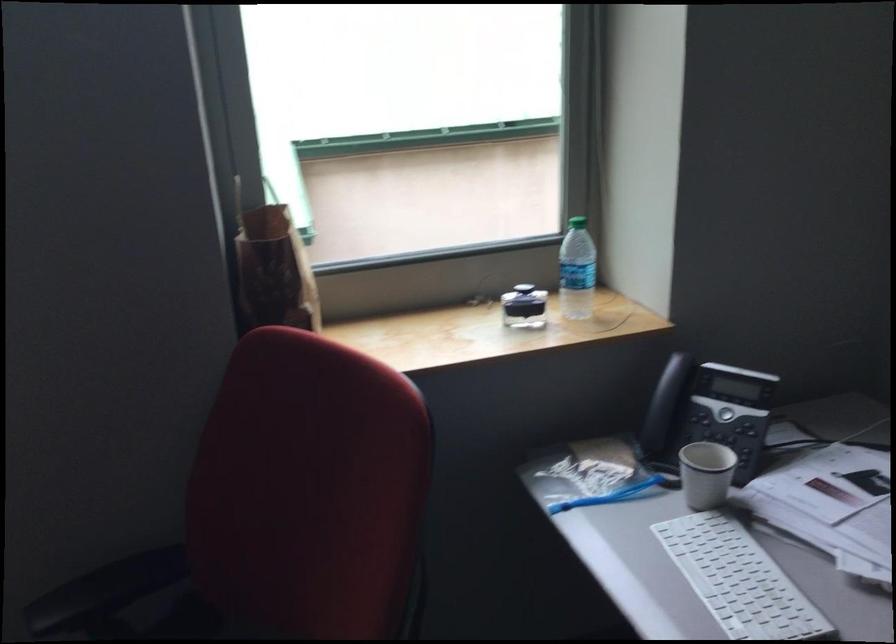
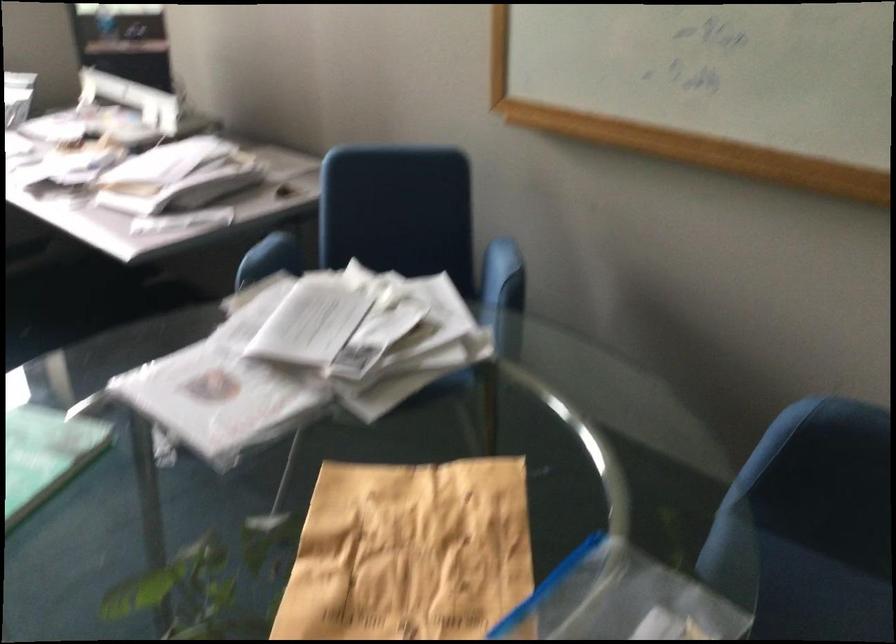
Question: What movement of the cameraman would produce the second image?

Choices:
 (A) Left
 (B) Right
 (C) Forward
 (D) Backward

Answer: (D)